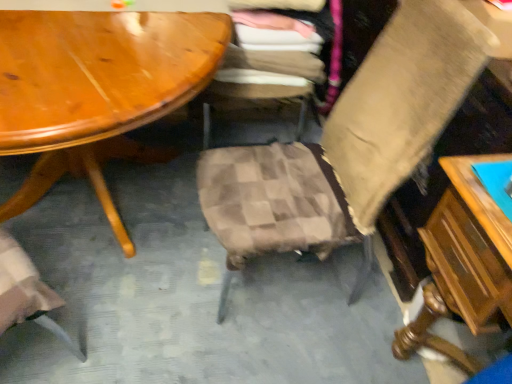
Question: Is beige fabric chair at center, marked as the 2th chair in a left-to-right arrangement, wider or thinner than wooden table at right?

Choices:
 (A) wide
 (B) thin

Answer: (B)

Question: Considering the relative positions of beige fabric chair at center, marked as the 2th chair in a left-to-right arrangement, and wooden table at right in the image provided, is beige fabric chair at center, marked as the 2th chair in a left-to-right arrangement, to the left or to the right of wooden table at right?

Choices:
 (A) right
 (B) left

Answer: (B)

Question: Considering the real-world distances, which object is farthest from the wooden table at right?

Choices:
 (A) beige fabric chair at center, marked as the 2th chair in a left-to-right arrangement
 (B) plaid fabric chair at center, which is counted as the first chair, starting from the left

Answer: (B)

Question: Which object is positioned closest to the beige fabric chair at center, marked as the 2th chair in a left-to-right arrangement?

Choices:
 (A) wooden table at right
 (B) plaid fabric chair at center, which is the second chair from right to left

Answer: (A)